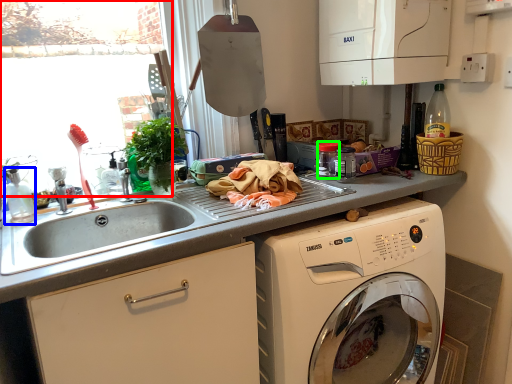
Question: Estimate the real-world distances between objects in this image. Which object is closer to window screen (highlighted by a red box), bottle (highlighted by a blue box) or appliance (highlighted by a green box)?

Choices:
 (A) bottle
 (B) appliance

Answer: (A)